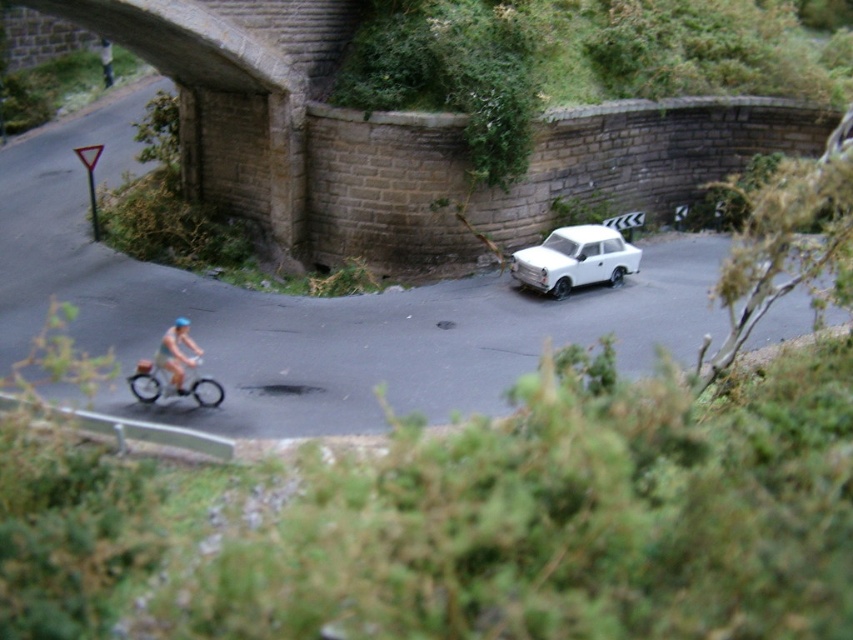
Is white matte car at center positioned before metallic silver bicycle at left?

No, it is not.

Measure the distance between white matte car at center and camera.

white matte car at center and camera are 18.24 meters apart.

The width and height of the screenshot is (853, 640). In order to click on white matte car at center in this screenshot , I will do `click(575, 259)`.

Does white matte car at center appear on the right side of light blue fabric cyclist at lower left?

Indeed, white matte car at center is positioned on the right side of light blue fabric cyclist at lower left.

Can you confirm if white matte car at center is wider than light blue fabric cyclist at lower left?

Indeed, white matte car at center has a greater width compared to light blue fabric cyclist at lower left.

Where is `white matte car at center`? Image resolution: width=853 pixels, height=640 pixels. white matte car at center is located at coordinates (575, 259).

Who is more forward, (167, 394) or (195, 352)?

Positioned in front is point (167, 394).

Based on the photo, who is positioned more to the right, metallic silver bicycle at left or light blue fabric cyclist at lower left?

Positioned to the right is light blue fabric cyclist at lower left.

The height and width of the screenshot is (640, 853). Find the location of `metallic silver bicycle at left`. metallic silver bicycle at left is located at coordinates (172, 385).